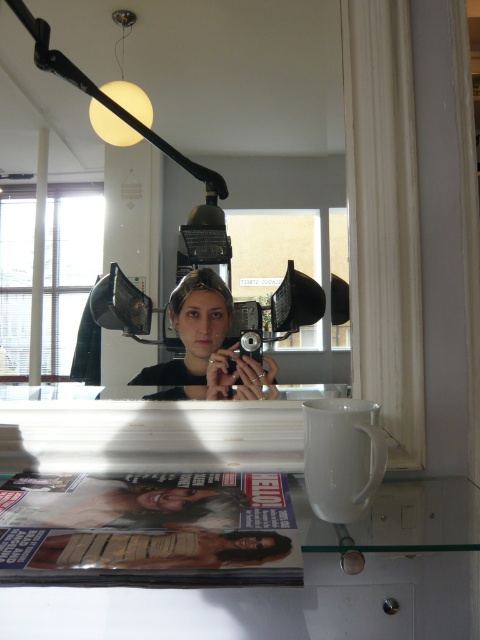
Is matte black camera at center taller than matte black magazine at lower center?

Yes.

Can you confirm if matte black camera at center is thinner than matte black magazine at lower center?

Yes.

Is point (192, 374) positioned in front of point (228, 504)?

No, it is behind (228, 504).

You are a GUI agent. You are given a task and a screenshot of the screen. Output one action in this format:
    pyautogui.click(x=<x>, y=<y>)
    Task: Click on the matte black camera at center
    
    Given the screenshot: What is the action you would take?
    pyautogui.click(x=204, y=346)

Consider the image. Does white glossy mirror at upper center appear over matte black magazine at lower center?

Yes.

Based on the photo, is white glossy mirror at upper center positioned in front of matte black magazine at lower center?

That is False.

Which is in front, point (200, 42) or point (194, 513)?

Point (194, 513) is more forward.

Where is `white glossy mirror at upper center`? The height and width of the screenshot is (640, 480). white glossy mirror at upper center is located at coordinates (242, 76).

Can you confirm if matte black camera at center is taller than wooden magazine at lower center?

Correct, matte black camera at center is much taller as wooden magazine at lower center.

Between matte black camera at center and wooden magazine at lower center, which one appears on the left side from the viewer's perspective?

From the viewer's perspective, wooden magazine at lower center appears more on the left side.

Is point (231, 310) more distant than point (128, 544)?

Yes, it is.

You are a GUI agent. You are given a task and a screenshot of the screen. Output one action in this format:
    pyautogui.click(x=<x>, y=<y>)
    Task: Click on the matte black camera at center
    
    Given the screenshot: What is the action you would take?
    pyautogui.click(x=204, y=346)